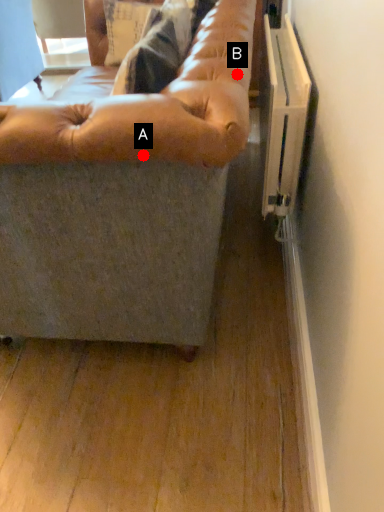
Question: Two points are circled on the image, labeled by A and B beside each circle. Which point is closer to the camera taking this photo?

Choices:
 (A) A is closer
 (B) B is closer

Answer: (A)